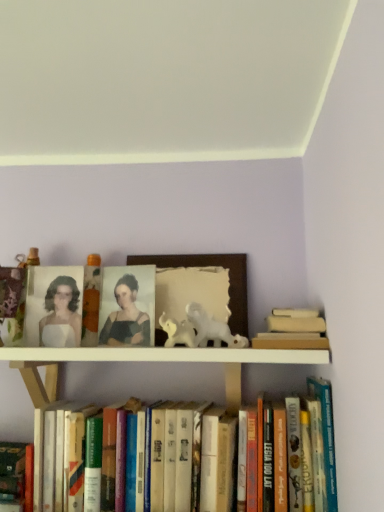
Question: Are hardcover books at lower center, which ranks as the second book in right-to-left order, and matte orange candle at upper center beside each other?

Choices:
 (A) yes
 (B) no

Answer: (B)

Question: Considering the relative sizes of hardcover books at lower center, the 2th book positioned from the left, and matte orange candle at upper center in the image provided, is hardcover books at lower center, the 2th book positioned from the left, bigger than matte orange candle at upper center?

Choices:
 (A) yes
 (B) no

Answer: (A)

Question: Does hardcover books at lower center, the 2th book positioned from the left, have a smaller size compared to matte orange candle at upper center?

Choices:
 (A) no
 (B) yes

Answer: (A)

Question: From a real-world perspective, does hardcover books at lower center, which ranks as the second book in right-to-left order, stand above matte orange candle at upper center?

Choices:
 (A) no
 (B) yes

Answer: (A)

Question: Considering the relative sizes of hardcover books at lower center, the 2th book positioned from the left, and matte orange candle at upper center in the image provided, is hardcover books at lower center, the 2th book positioned from the left, thinner than matte orange candle at upper center?

Choices:
 (A) no
 (B) yes

Answer: (A)

Question: Based on their sizes in the image, would you say matte orange candle at upper center is bigger or smaller than matte black portrait at center?

Choices:
 (A) big
 (B) small

Answer: (A)

Question: In the image, is matte orange candle at upper center positioned in front of or behind matte black portrait at center?

Choices:
 (A) behind
 (B) front

Answer: (A)

Question: Is point (97, 270) positioned closer to the camera than point (119, 293)?

Choices:
 (A) closer
 (B) farther

Answer: (B)

Question: Do you think matte orange candle at upper center is within matte black portrait at center, or outside of it?

Choices:
 (A) outside
 (B) inside

Answer: (A)

Question: Is hardcover books at lower center, the 2th book positioned from the left, wider or thinner than wooden picture frame at center?

Choices:
 (A) thin
 (B) wide

Answer: (B)

Question: In terms of height, does hardcover books at lower center, which ranks as the second book in right-to-left order, look taller or shorter compared to wooden picture frame at center?

Choices:
 (A) short
 (B) tall

Answer: (B)

Question: From the image's perspective, relative to wooden picture frame at center, is hardcover books at lower center, which ranks as the second book in right-to-left order, above or below?

Choices:
 (A) below
 (B) above

Answer: (A)

Question: Which is correct: hardcover books at lower center, which ranks as the second book in right-to-left order, is inside wooden picture frame at center, or outside of it?

Choices:
 (A) outside
 (B) inside

Answer: (A)

Question: In terms of height, does hardcover books at lower center, the 2th book positioned from the left, look taller or shorter compared to white glossy horse at center?

Choices:
 (A) tall
 (B) short

Answer: (A)

Question: In the image, is hardcover books at lower center, the 2th book positioned from the left, positioned in front of or behind white glossy horse at center?

Choices:
 (A) front
 (B) behind

Answer: (A)